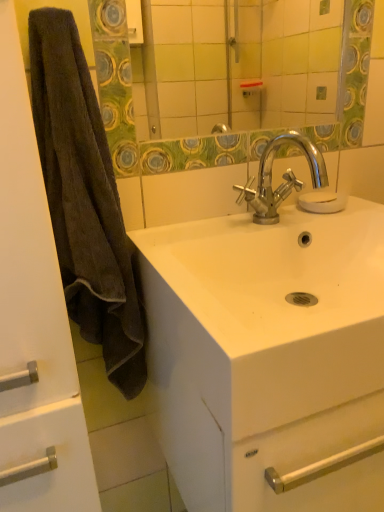
Question: From the image's perspective, relative to green textured mirror at upper center, is chrome metallic faucet at center above or below?

Choices:
 (A) below
 (B) above

Answer: (A)

Question: Considering the relative positions of chrome metallic faucet at center and green textured mirror at upper center in the image provided, is chrome metallic faucet at center to the left or to the right of green textured mirror at upper center?

Choices:
 (A) left
 (B) right

Answer: (B)

Question: Which is nearer to the white glossy sink at center?

Choices:
 (A) transparent glass soap at center
 (B) chrome metallic faucet at center
 (C) brown fuzzy towel at left
 (D) brown fuzzy towel at left
 (E) green textured mirror at upper center

Answer: (B)

Question: Considering the real-world distances, which object is closest to the transparent glass soap at center?

Choices:
 (A) brown fuzzy towel at left
 (B) green textured mirror at upper center
 (C) chrome metallic faucet at center
 (D) white glossy sink at center
 (E) brown fuzzy towel at left

Answer: (C)